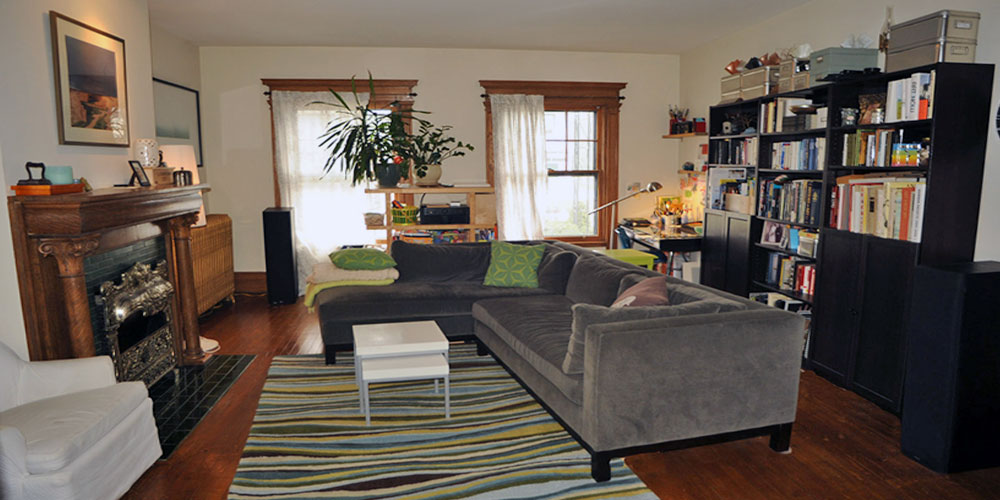
You are a GUI agent. You are given a task and a screenshot of the screen. Output one action in this format:
    pyautogui.click(x=<x>, y=<y>)
    Task: Click on the window
    Image resolution: width=1000 pixels, height=500 pixels.
    Given the screenshot: What is the action you would take?
    pyautogui.click(x=558, y=193)